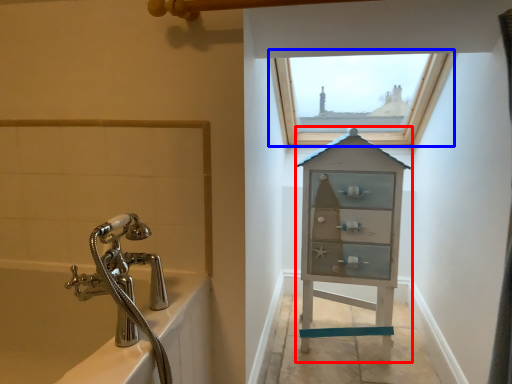
Question: Which object is further to the camera taking this photo, medicine cabinet (highlighted by a red box) or window (highlighted by a blue box)?

Choices:
 (A) medicine cabinet
 (B) window

Answer: (B)